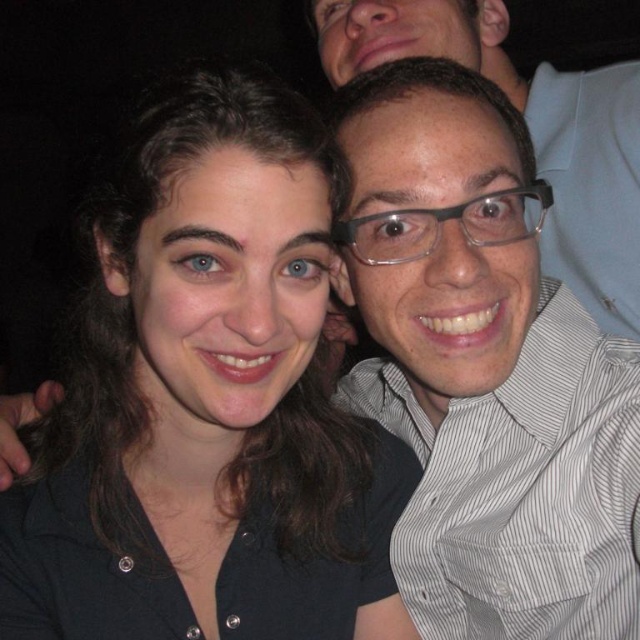
You are taking a selfie and want to ensure that the point at coordinates (208, 403) falls on the black matte shirt at center. Based on the scene description, is this possible?

Yes, the point at coordinates (208, 403) is on the black matte shirt at center according to the description.

You are taking a photo of two people in a room. You notice two points marked in the image. The first point is at coordinate point (620,627) and the second point is at coordinate point (330,19). According to the scene description, which point is closer to the camera?

Point (620,627) is in front of point (330,19), so it is closer to the camera.

You are a photographer adjusting the lighting for a portrait. You notice the white striped shirt at center and the clear plastic glasses at upper right in the frame. Which object appears narrower in the photo?

The white striped shirt at center appears narrower than the clear plastic glasses at upper right because its width is less than the glasses.